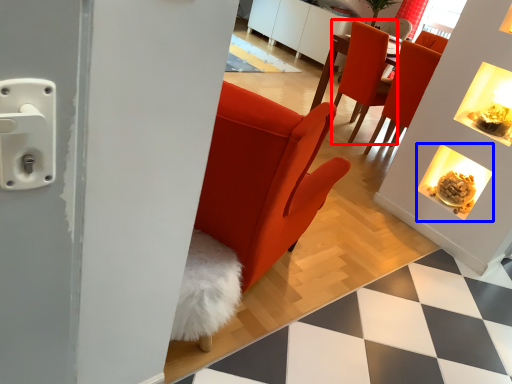
Question: Which object is further to the camera taking this photo, chair (highlighted by a red box) or fireplace (highlighted by a blue box)?

Choices:
 (A) chair
 (B) fireplace

Answer: (A)